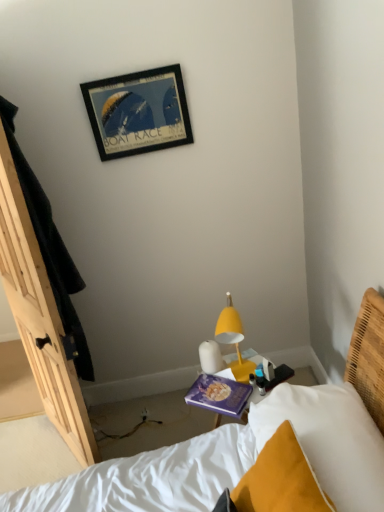
Question: Can you confirm if white soft pillow at lower right is shorter than purple matte book at center?

Choices:
 (A) yes
 (B) no

Answer: (B)

Question: From a real-world perspective, is white soft pillow at lower right located higher than purple matte book at center?

Choices:
 (A) yes
 (B) no

Answer: (A)

Question: Could purple matte book at center be considered to be inside white soft pillow at lower right?

Choices:
 (A) no
 (B) yes

Answer: (A)

Question: Is white soft pillow at lower right closer to camera compared to purple matte book at center?

Choices:
 (A) yes
 (B) no

Answer: (A)

Question: From the image's perspective, is white soft pillow at lower right under purple matte book at center?

Choices:
 (A) yes
 (B) no

Answer: (A)

Question: In terms of height, does white soft pillow at lower right look taller or shorter compared to yellow matte lamp at center-right?

Choices:
 (A) short
 (B) tall

Answer: (B)

Question: From a real-world perspective, relative to yellow matte lamp at center-right, is white soft pillow at lower right vertically above or below?

Choices:
 (A) above
 (B) below

Answer: (B)

Question: Is point (336, 502) closer or farther from the camera than point (226, 335)?

Choices:
 (A) farther
 (B) closer

Answer: (B)

Question: Is white soft pillow at lower right spatially inside yellow matte lamp at center-right, or outside of it?

Choices:
 (A) inside
 (B) outside

Answer: (B)

Question: Considering the positions of black matte picture frame at upper center and yellow matte lamp at center-right in the image, is black matte picture frame at upper center bigger or smaller than yellow matte lamp at center-right?

Choices:
 (A) small
 (B) big

Answer: (A)

Question: Is black matte picture frame at upper center wider or thinner than yellow matte lamp at center-right?

Choices:
 (A) wide
 (B) thin

Answer: (B)

Question: From a real-world perspective, is black matte picture frame at upper center positioned above or below yellow matte lamp at center-right?

Choices:
 (A) below
 (B) above

Answer: (B)

Question: Considering the positions of black matte picture frame at upper center and yellow matte lamp at center-right in the image, is black matte picture frame at upper center taller or shorter than yellow matte lamp at center-right?

Choices:
 (A) short
 (B) tall

Answer: (A)

Question: In terms of width, does yellow matte lamp at center-right look wider or thinner when compared to white soft pillow at lower right?

Choices:
 (A) wide
 (B) thin

Answer: (B)

Question: Is point (228, 317) positioned closer to the camera than point (352, 475)?

Choices:
 (A) farther
 (B) closer

Answer: (A)